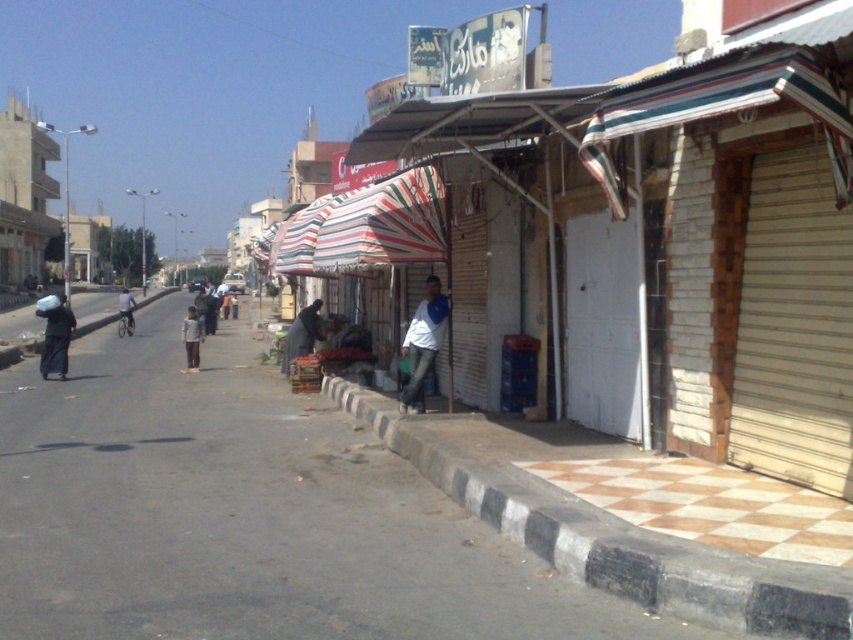
In the scene shown: Does white corrugated metal hut at center right appear under dark blue fabric at center?

No, white corrugated metal hut at center right is not below dark blue fabric at center.

Which of these two, white corrugated metal hut at center right or dark blue fabric at center, stands shorter?

With less height is dark blue fabric at center.

Does point (699, 346) come farther from viewer compared to point (294, 332)?

No, it is in front of (294, 332).

This screenshot has width=853, height=640. Identify the location of white corrugated metal hut at center right. (753, 234).

You are a GUI agent. You are given a task and a screenshot of the screen. Output one action in this format:
    pyautogui.click(x=<x>, y=<y>)
    Task: Click on the light brown concrete building at left
    This screenshot has height=640, width=853.
    Given the screenshot: What is the action you would take?
    pyautogui.click(x=24, y=195)

Based on the photo, which is below, light brown concrete building at left or light blue fabric shirt at center?

light blue fabric shirt at center

Is point (57, 234) farther from camera compared to point (196, 321)?

Yes, point (57, 234) is farther from viewer.

Locate an element on the screen. This screenshot has width=853, height=640. light brown concrete building at left is located at coordinates (24, 195).

Measure the distance between point (521, 528) and camera.

A distance of 20.03 feet exists between point (521, 528) and camera.

Between point (457, 449) and point (196, 312), which one is positioned in front?

Positioned in front is point (457, 449).

Which is behind, point (589, 563) or point (190, 349)?

Point (190, 349)

Locate an element on the screen. This screenshot has width=853, height=640. checkerboard tile curb at lower center is located at coordinates (614, 540).